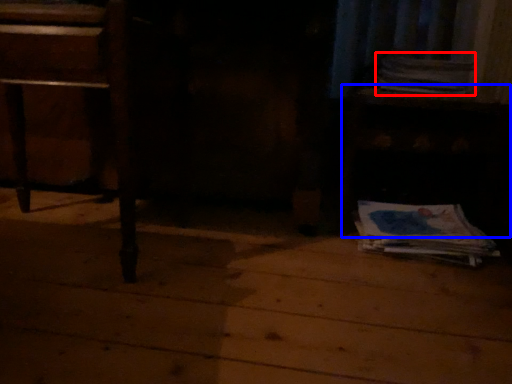
Question: Among these objects, which one is nearest to the camera, paperback book (highlighted by a red box) or table (highlighted by a blue box)?

Choices:
 (A) paperback book
 (B) table

Answer: (B)